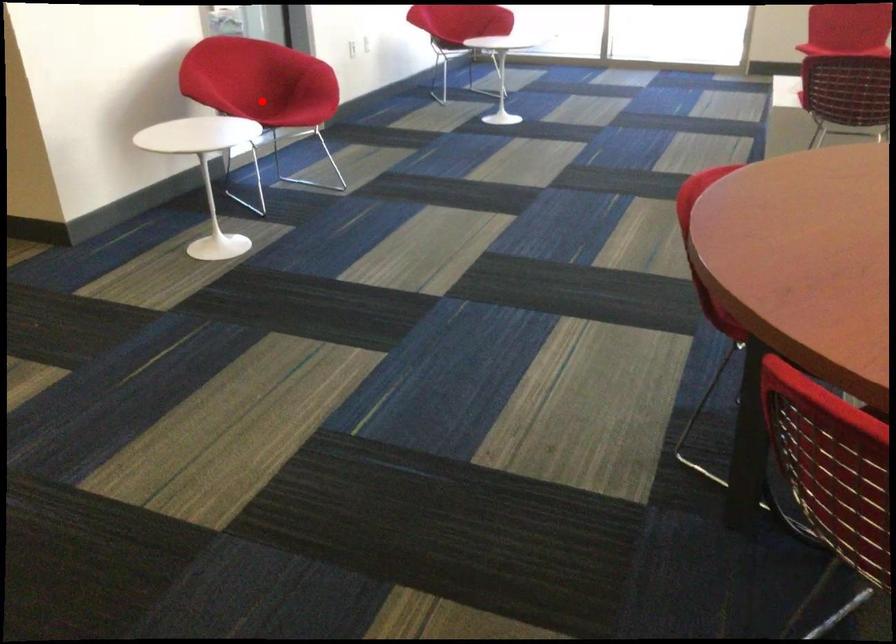
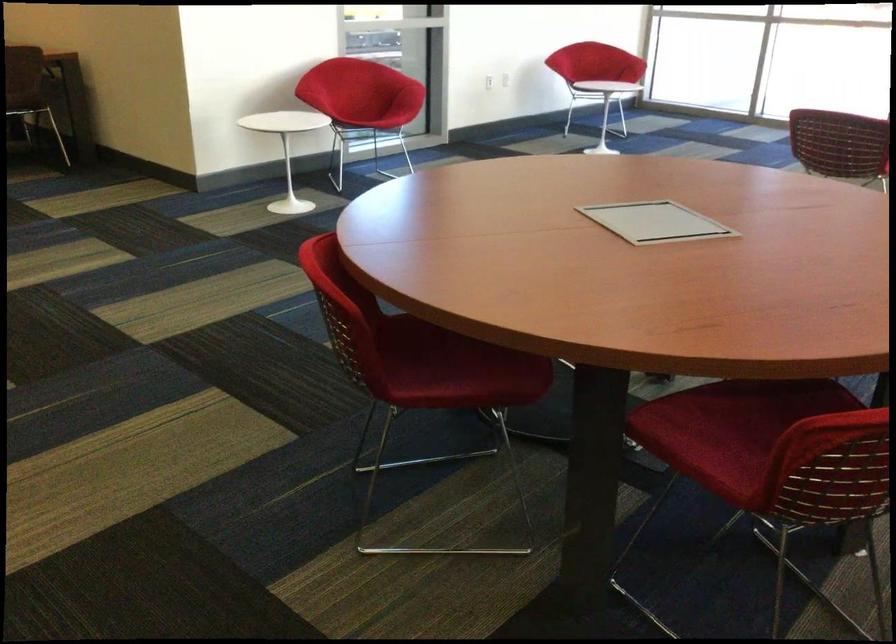
Where in the second image is the point corresponding to the highlighted location from the first image?

(363, 104)